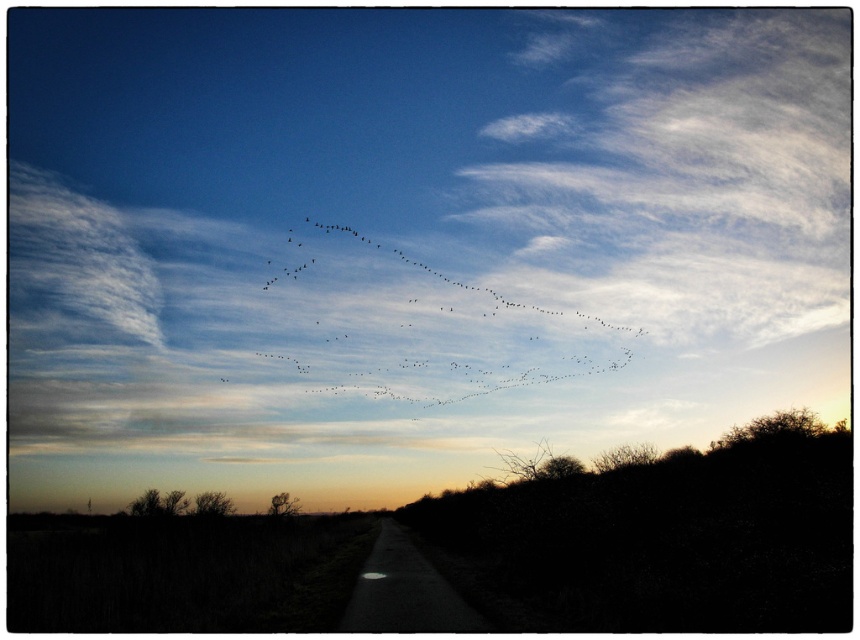
You are an ornithologist observing the sky and notice the white fluffy cloud at upper center and the black matte birds at upper center. Which object is closer to you?

The black matte birds at upper center are closer to you because they are in front of the white fluffy cloud at upper center.

You are an ornithologist observing the scene. You notice the white fluffy cloud at upper center and the black matte birds at upper center. Which object is positioned higher in the sky?

The white fluffy cloud at upper center is taller than the black matte birds at upper center, so the white fluffy cloud at upper center is positioned higher in the sky.